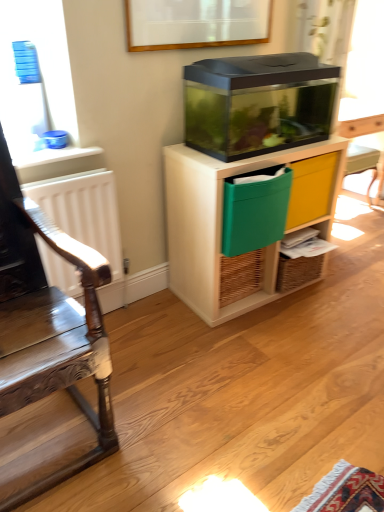
Question: From the image's perspective, does green fabric drawer at center-right appear higher than transparent plastic cabinet at center?

Choices:
 (A) no
 (B) yes

Answer: (B)

Question: Are green fabric drawer at center-right and transparent plastic cabinet at center located far from each other?

Choices:
 (A) no
 (B) yes

Answer: (A)

Question: Does green fabric drawer at center-right contain transparent plastic cabinet at center?

Choices:
 (A) yes
 (B) no

Answer: (B)

Question: Is green fabric drawer at center-right at the left side of transparent plastic cabinet at center?

Choices:
 (A) no
 (B) yes

Answer: (A)

Question: Is green fabric drawer at center-right in contact with transparent plastic cabinet at center?

Choices:
 (A) no
 (B) yes

Answer: (A)

Question: Is green fabric drawer at center-right smaller than transparent plastic cabinet at center?

Choices:
 (A) no
 (B) yes

Answer: (B)

Question: Is the depth of wooden polished chair at left less than that of green fabric drawer at center-right?

Choices:
 (A) yes
 (B) no

Answer: (A)

Question: Is wooden polished chair at left to the left of green fabric drawer at center-right from the viewer's perspective?

Choices:
 (A) yes
 (B) no

Answer: (A)

Question: Does wooden polished chair at left have a lesser width compared to green fabric drawer at center-right?

Choices:
 (A) yes
 (B) no

Answer: (B)

Question: Is wooden polished chair at left placed right next to green fabric drawer at center-right?

Choices:
 (A) yes
 (B) no

Answer: (B)

Question: Is wooden polished chair at left facing towards green fabric drawer at center-right?

Choices:
 (A) no
 (B) yes

Answer: (A)

Question: Are wooden polished chair at left and green fabric drawer at center-right far apart?

Choices:
 (A) no
 (B) yes

Answer: (B)

Question: From a real-world perspective, does transparent plastic cabinet at center sit lower than white matte radiator at left?

Choices:
 (A) yes
 (B) no

Answer: (B)